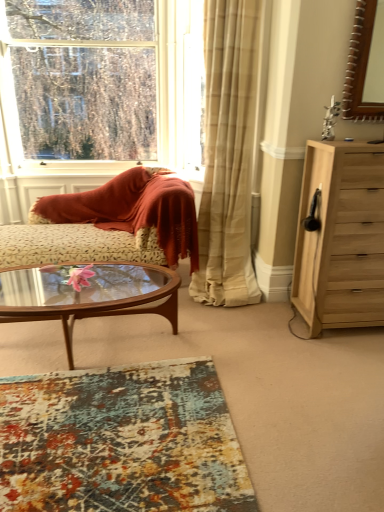
Question: Could you tell me if textured multicolored rug at lower center is facing clear glass window at upper left?

Choices:
 (A) no
 (B) yes

Answer: (A)

Question: Considering the relative sizes of textured multicolored rug at lower center and clear glass window at upper left in the image provided, is textured multicolored rug at lower center smaller than clear glass window at upper left?

Choices:
 (A) yes
 (B) no

Answer: (A)

Question: Does textured multicolored rug at lower center appear on the right side of clear glass window at upper left?

Choices:
 (A) no
 (B) yes

Answer: (B)

Question: From a real-world perspective, is textured multicolored rug at lower center located higher than clear glass window at upper left?

Choices:
 (A) yes
 (B) no

Answer: (B)

Question: From the image's perspective, is textured multicolored rug at lower center located above clear glass window at upper left?

Choices:
 (A) yes
 (B) no

Answer: (B)

Question: Does textured multicolored rug at lower center have a lesser height compared to clear glass window at upper left?

Choices:
 (A) yes
 (B) no

Answer: (A)

Question: From the image's perspective, would you say clear glass window at upper left is positioned over light wood chest of drawers at right?

Choices:
 (A) yes
 (B) no

Answer: (A)

Question: Does clear glass window at upper left have a greater width compared to light wood chest of drawers at right?

Choices:
 (A) no
 (B) yes

Answer: (A)

Question: Does clear glass window at upper left have a smaller size compared to light wood chest of drawers at right?

Choices:
 (A) no
 (B) yes

Answer: (A)

Question: From a real-world perspective, is clear glass window at upper left physically below light wood chest of drawers at right?

Choices:
 (A) yes
 (B) no

Answer: (B)

Question: From the image's perspective, does clear glass window at upper left appear lower than light wood chest of drawers at right?

Choices:
 (A) no
 (B) yes

Answer: (A)

Question: Can you confirm if clear glass window at upper left is shorter than light wood chest of drawers at right?

Choices:
 (A) yes
 (B) no

Answer: (B)

Question: Can you confirm if textured multicolored rug at lower center is bigger than transparent glass coffee table at center?

Choices:
 (A) yes
 (B) no

Answer: (B)